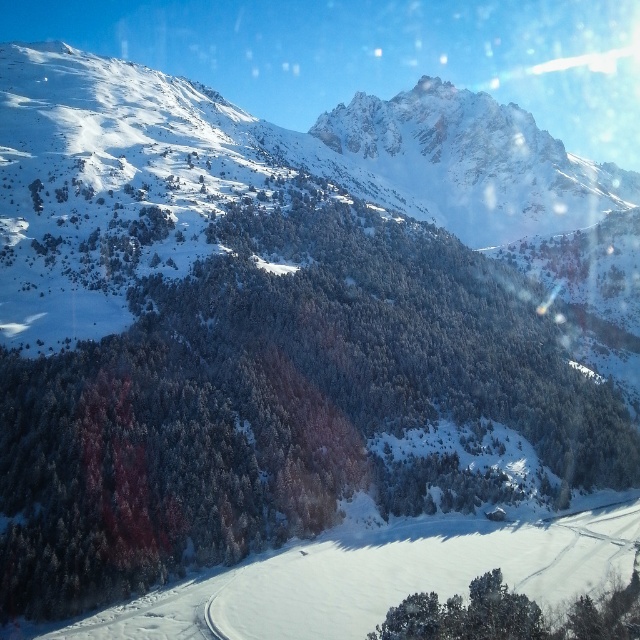
Between green matte tree at center and green matte tree at lower right, which one has less height?

With less height is green matte tree at lower right.

This screenshot has height=640, width=640. I want to click on green matte tree at center, so click(x=280, y=403).

Is point (616, 301) positioned after point (573, 621)?

Yes, point (616, 301) is behind point (573, 621).

Is point (566, 240) closer to camera compared to point (564, 618)?

That is False.

What are the coordinates of `snowy rocky mountain at upper center` in the screenshot? It's located at coord(273,182).

Can you confirm if green matte tree at center is thinner than snowy rocky mountain at upper center?

Correct, green matte tree at center's width is less than snowy rocky mountain at upper center's.

Can you confirm if green matte tree at center is positioned above snowy rocky mountain at upper center?

No, green matte tree at center is not above snowy rocky mountain at upper center.

Locate an element on the screen. This screenshot has width=640, height=640. green matte tree at center is located at coordinates (280, 403).